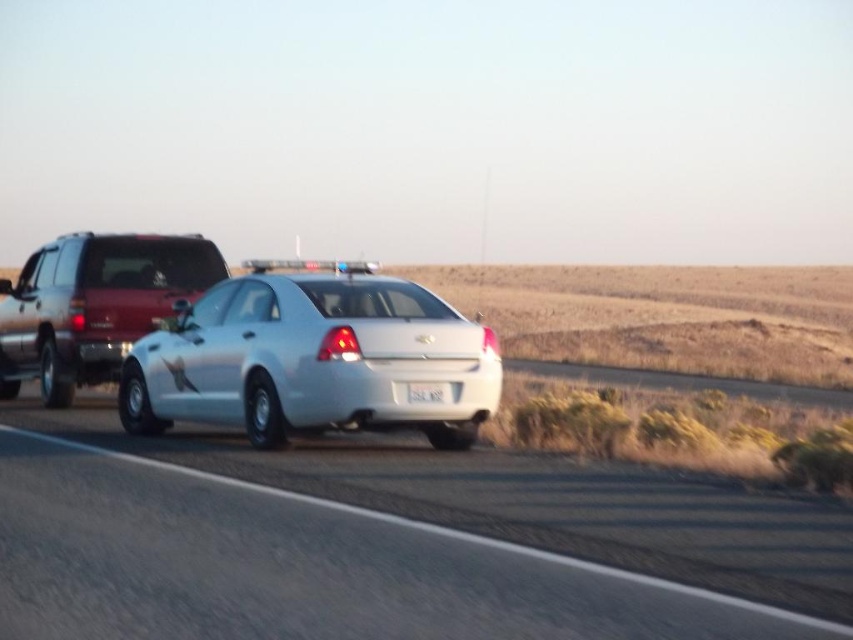
I want to click on white glossy car at center, so click(x=357, y=561).

Does white glossy car at center have a lesser width compared to white plastic license plate at center?

No, white glossy car at center is not thinner than white plastic license plate at center.

Describe the element at coordinates (357, 561) in the screenshot. The height and width of the screenshot is (640, 853). I see `white glossy car at center` at that location.

This screenshot has width=853, height=640. In order to click on white glossy car at center in this screenshot , I will do `click(357, 561)`.

Can you confirm if white glossy car at center is bigger than white glossy sedan at center?

No.

Does white glossy car at center have a smaller size compared to white glossy sedan at center?

Correct, white glossy car at center occupies less space than white glossy sedan at center.

Is point (210, 582) less distant than point (154, 400)?

Yes, point (210, 582) is closer to viewer.

Find the location of a particular element. The height and width of the screenshot is (640, 853). white glossy car at center is located at coordinates (357, 561).

Is point (223, 413) positioned before point (437, 388)?

No, (223, 413) is further to viewer.

Who is lower down, white glossy sedan at center or white plastic license plate at center?

white plastic license plate at center is below.

Between point (277, 432) and point (421, 388), which one is positioned in front?

Point (421, 388)

Image resolution: width=853 pixels, height=640 pixels. I want to click on white glossy sedan at center, so click(312, 358).